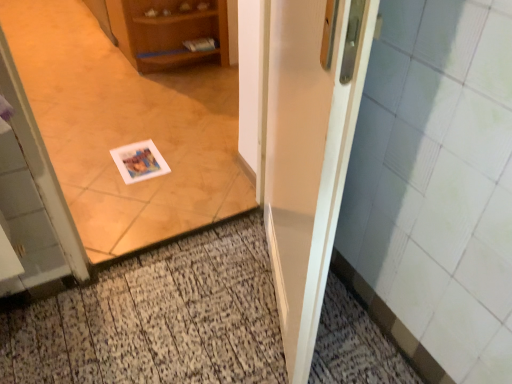
Question: From a real-world perspective, is white paper postcard at center positioned above or below white glossy door at center?

Choices:
 (A) below
 (B) above

Answer: (A)

Question: In terms of size, does white paper postcard at center appear bigger or smaller than white glossy door at center?

Choices:
 (A) small
 (B) big

Answer: (A)

Question: Which object is the farthest from the white glossy door at center?

Choices:
 (A) wooden cabinet at upper left
 (B) white paper at center
 (C) white paper postcard at center

Answer: (A)

Question: Estimate the real-world distances between objects in this image. Which object is closer to the wooden cabinet at upper left?

Choices:
 (A) white glossy door at center
 (B) white paper at center
 (C) white paper postcard at center

Answer: (B)